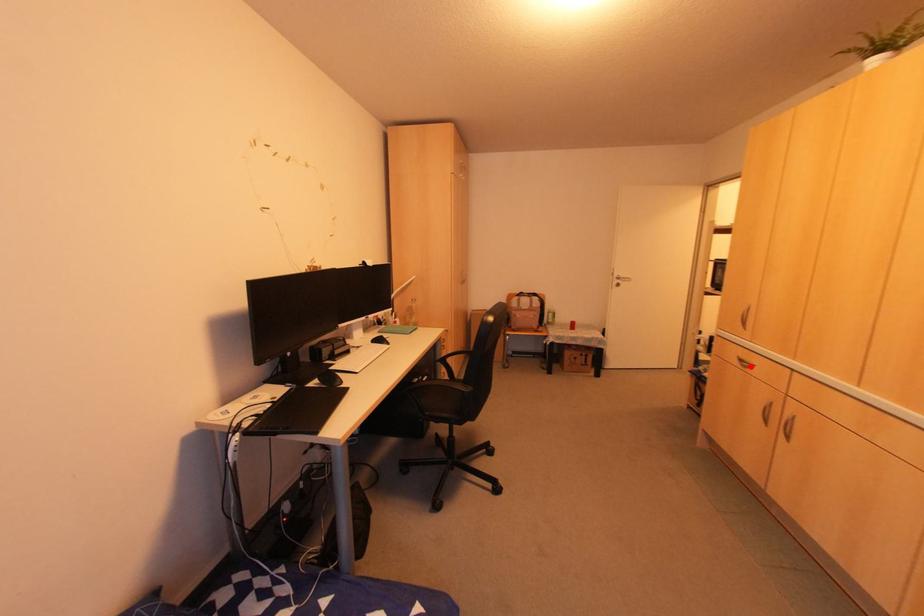
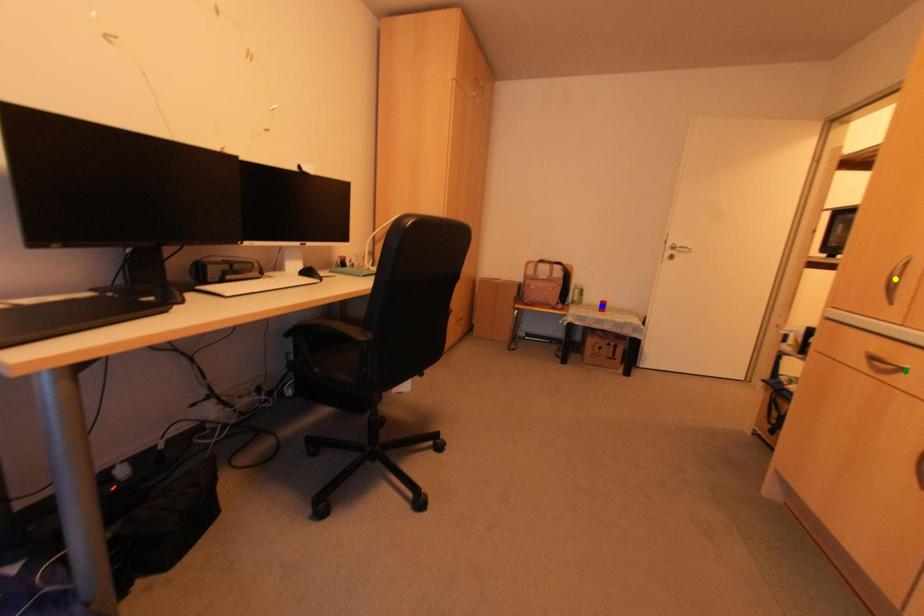
Question: I am providing you with two images of the same scene from different viewpoints. A red point is marked on the first image. You are given multiple points on the second image. Can you choose the point in image 2 that corresponds to the point in image 1?

Choices:
 (A) green point
 (B) blue point
 (C) yellow point

Answer: (A)